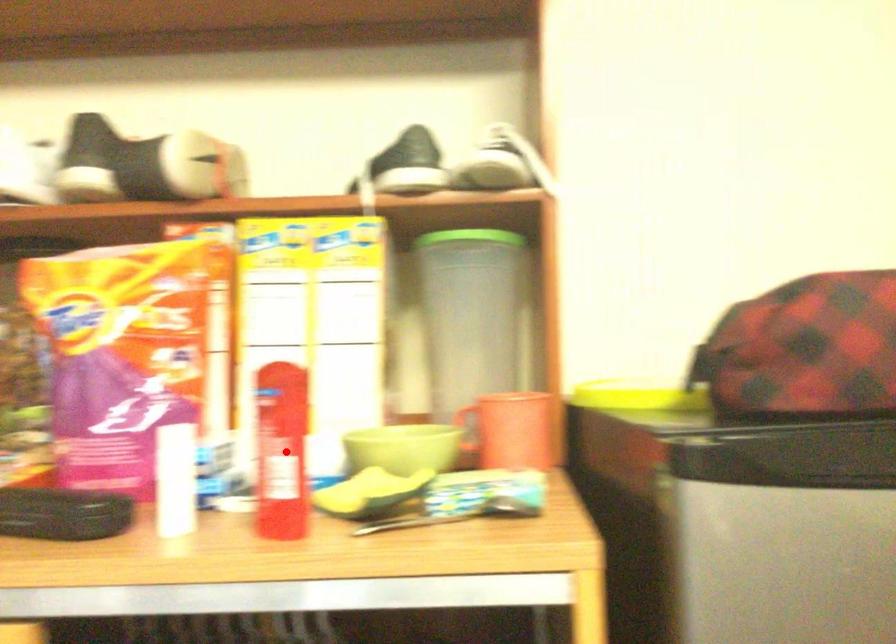
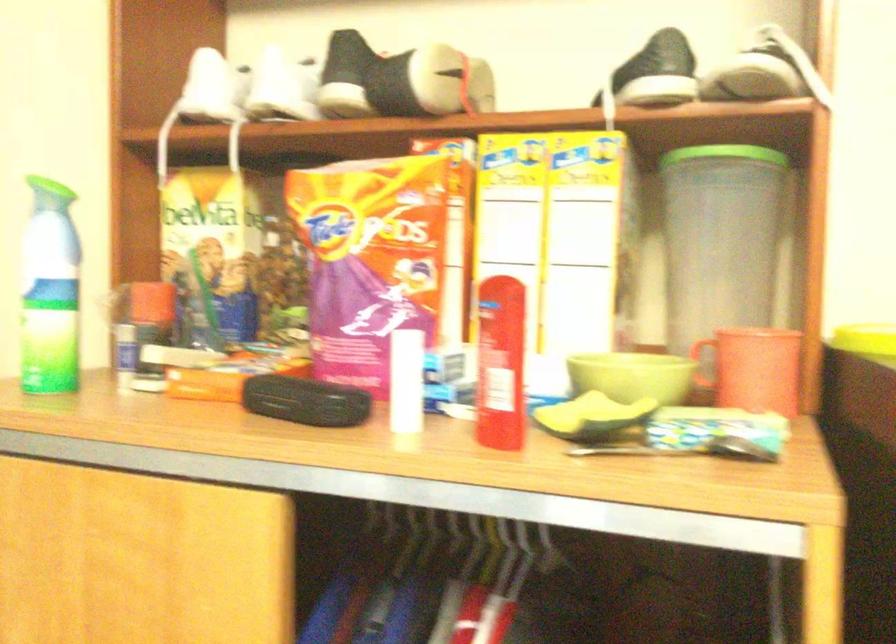
Find the pixel in the second image that matches the highlighted location in the first image.

(501, 364)